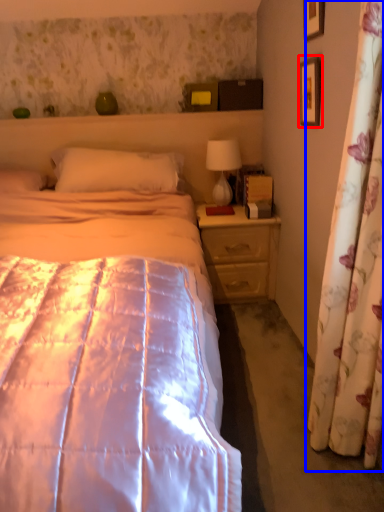
Question: Which point is closer to the camera, picture frame (highlighted by a red box) or curtain (highlighted by a blue box)?

Choices:
 (A) picture frame
 (B) curtain

Answer: (B)